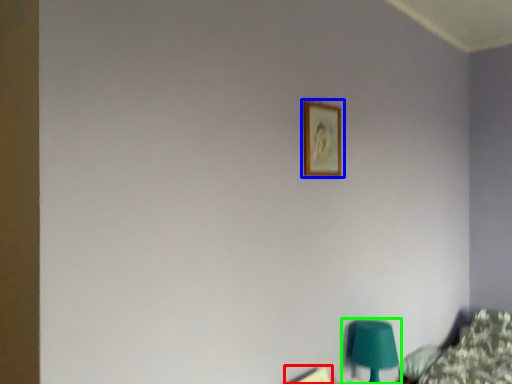
Question: Considering the real-world distances, which object is closest to picture frame (highlighted by a red box)? picture frame (highlighted by a blue box) or table lamp (highlighted by a green box).

Choices:
 (A) picture frame
 (B) table lamp

Answer: (B)